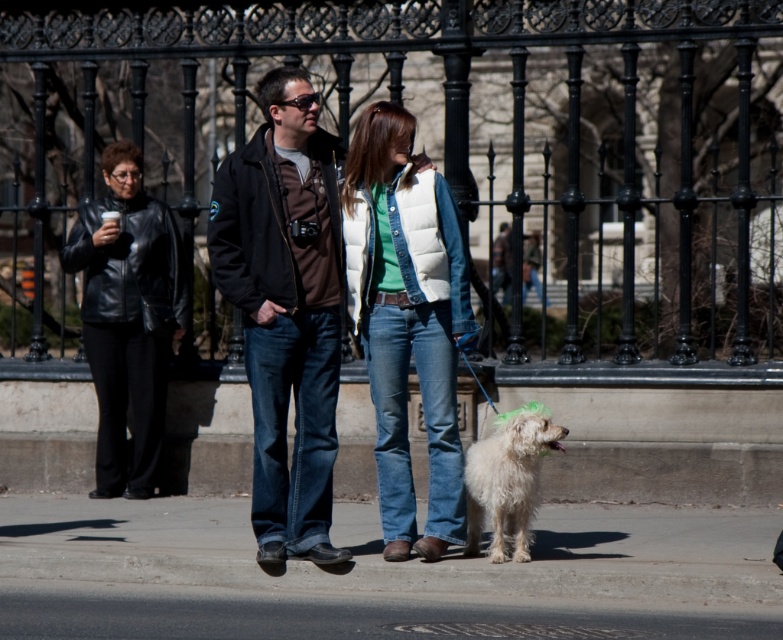
Question: Which object is the closest to the gray concrete pavement at lower center?

Choices:
 (A) black leather jacket at left
 (B) white puffy vest at center
 (C) white fluffy dog at lower right
 (D) dark brown leather jacket at center

Answer: (C)

Question: Does dark brown leather jacket at center have a larger size compared to white puffy vest at center?

Choices:
 (A) yes
 (B) no

Answer: (A)

Question: Does dark brown leather jacket at center have a lesser width compared to white puffy vest at center?

Choices:
 (A) yes
 (B) no

Answer: (B)

Question: Is white puffy vest at center positioned behind black leather jacket at left?

Choices:
 (A) no
 (B) yes

Answer: (A)

Question: Which point is closer to the camera?

Choices:
 (A) (118, 317)
 (B) (514, 508)

Answer: (B)

Question: Which object is positioned closest to the white puffy vest at center?

Choices:
 (A) black leather jacket at left
 (B) gray concrete pavement at lower center
 (C) white fluffy dog at lower right

Answer: (C)